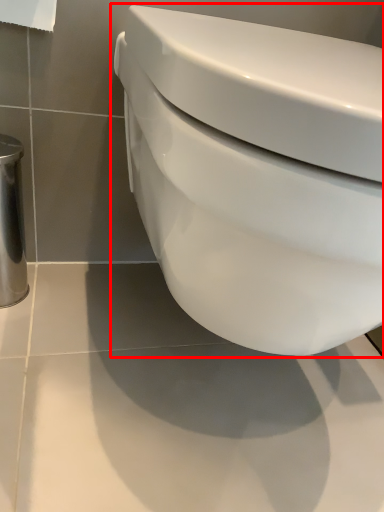
Question: Where is toilet (annotated by the red box) located in relation to toilet paper in the image?

Choices:
 (A) left
 (B) right

Answer: (B)